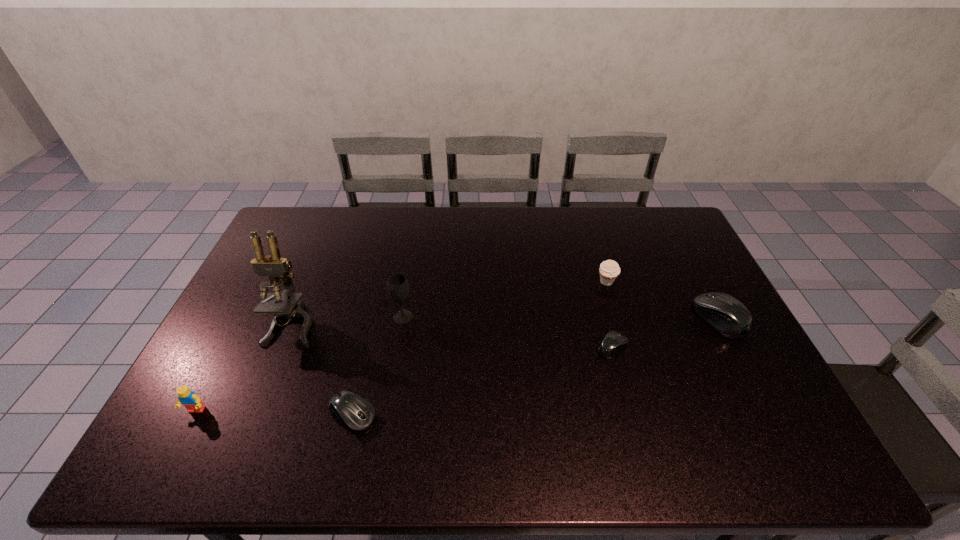
Locate an element on the screen. This screenshot has height=540, width=960. the second shortest mouse is located at coordinates (355, 413).

What are the coordinates of `the nearest mouse` in the screenshot? It's located at (355, 413).

You are a GUI agent. You are given a task and a screenshot of the screen. Output one action in this format:
    pyautogui.click(x=<x>, y=<y>)
    Task: Click on the shortest mouse
    This screenshot has height=540, width=960.
    Given the screenshot: What is the action you would take?
    pyautogui.click(x=614, y=342)

Identify the location of the second mouse from left to right. The image size is (960, 540). (614, 342).

At what (x,y) coordinates should I click in order to perform the action: click on the rightmost object. Please return your answer as a coordinate pair (x, y). Looking at the image, I should click on (728, 316).

I want to click on the tallest mouse, so click(728, 316).

Where is `the sixth object from right to left`? the sixth object from right to left is located at coordinates click(273, 266).

Find the location of a particular element. The height and width of the screenshot is (540, 960). microscope is located at coordinates (273, 266).

You are a GUI agent. You are given a task and a screenshot of the screen. Output one action in this format:
    pyautogui.click(x=<x>, y=<y>)
    Task: Click on the farthest object
    The width and height of the screenshot is (960, 540).
    Given the screenshot: What is the action you would take?
    pyautogui.click(x=609, y=270)

You are a GUI agent. You are given a task and a screenshot of the screen. Output one action in this format:
    pyautogui.click(x=<x>, y=<y>)
    Task: Click on the wineglass
    This screenshot has height=540, width=960.
    Given the screenshot: What is the action you would take?
    pyautogui.click(x=397, y=285)